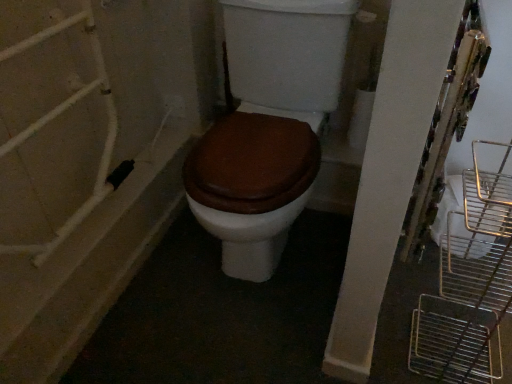
Question: Based on their positions, is brown matte toilet at center located to the left or right of black plastic plug at lower left?

Choices:
 (A) right
 (B) left

Answer: (A)

Question: Considering the positions of brown matte toilet at center and black plastic plug at lower left in the image, is brown matte toilet at center taller or shorter than black plastic plug at lower left?

Choices:
 (A) tall
 (B) short

Answer: (A)

Question: Is brown matte toilet at center bigger or smaller than black plastic plug at lower left?

Choices:
 (A) small
 (B) big

Answer: (B)

Question: Relative to brown matte toilet at center, is black plastic plug at lower left in front or behind?

Choices:
 (A) behind
 (B) front

Answer: (A)

Question: Considering the positions of point (203, 109) and point (247, 200), is point (203, 109) closer or farther from the camera than point (247, 200)?

Choices:
 (A) closer
 (B) farther

Answer: (B)

Question: Visually, is black plastic plug at lower left positioned to the left or to the right of brown matte toilet at center?

Choices:
 (A) right
 (B) left

Answer: (B)

Question: From a real-world perspective, relative to brown matte toilet at center, is black plastic plug at lower left vertically above or below?

Choices:
 (A) above
 (B) below

Answer: (B)